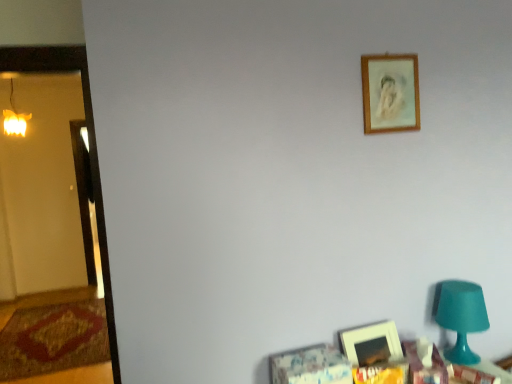
Question: Is wooden table at lower right far away from warm yellow glass at left?

Choices:
 (A) yes
 (B) no

Answer: (A)

Question: Are wooden table at lower right and warm yellow glass at left making contact?

Choices:
 (A) yes
 (B) no

Answer: (B)

Question: Does wooden table at lower right have a greater height compared to warm yellow glass at left?

Choices:
 (A) no
 (B) yes

Answer: (A)

Question: Is wooden table at lower right thinner than warm yellow glass at left?

Choices:
 (A) yes
 (B) no

Answer: (B)

Question: From a real-world perspective, is wooden table at lower right below warm yellow glass at left?

Choices:
 (A) yes
 (B) no

Answer: (A)

Question: Do you think wooden table at lower right is within teal plastic table lamp at lower right, or outside of it?

Choices:
 (A) outside
 (B) inside

Answer: (A)

Question: From the image's perspective, is wooden table at lower right located above or below teal plastic table lamp at lower right?

Choices:
 (A) above
 (B) below

Answer: (B)

Question: Is wooden table at lower right taller or shorter than teal plastic table lamp at lower right?

Choices:
 (A) short
 (B) tall

Answer: (A)

Question: Looking at the image, does wooden table at lower right seem bigger or smaller compared to teal plastic table lamp at lower right?

Choices:
 (A) big
 (B) small

Answer: (B)

Question: Based on their sizes in the image, would you say wooden frame at upper right, arranged as the 1th picture frame when viewed from the top, is bigger or smaller than teal plastic table lamp at lower right?

Choices:
 (A) big
 (B) small

Answer: (B)

Question: Considering the relative positions of wooden frame at upper right, which is the second picture frame in bottom-to-top order, and teal plastic table lamp at lower right in the image provided, is wooden frame at upper right, which is the second picture frame in bottom-to-top order, to the left or to the right of teal plastic table lamp at lower right?

Choices:
 (A) right
 (B) left

Answer: (B)

Question: Considering the positions of wooden frame at upper right, which is the second picture frame in bottom-to-top order, and teal plastic table lamp at lower right in the image, is wooden frame at upper right, which is the second picture frame in bottom-to-top order, taller or shorter than teal plastic table lamp at lower right?

Choices:
 (A) short
 (B) tall

Answer: (A)

Question: From a real-world perspective, is wooden frame at upper right, arranged as the 1th picture frame when viewed from the top, above or below teal plastic table lamp at lower right?

Choices:
 (A) below
 (B) above

Answer: (B)

Question: Considering the positions of matte wooden picture frame at lower right, the 1th picture frame positioned from the bottom, and warm yellow glass at left in the image, is matte wooden picture frame at lower right, the 1th picture frame positioned from the bottom, taller or shorter than warm yellow glass at left?

Choices:
 (A) tall
 (B) short

Answer: (B)

Question: In the image, is matte wooden picture frame at lower right, the 1th picture frame positioned from the bottom, on the left side or the right side of warm yellow glass at left?

Choices:
 (A) right
 (B) left

Answer: (A)